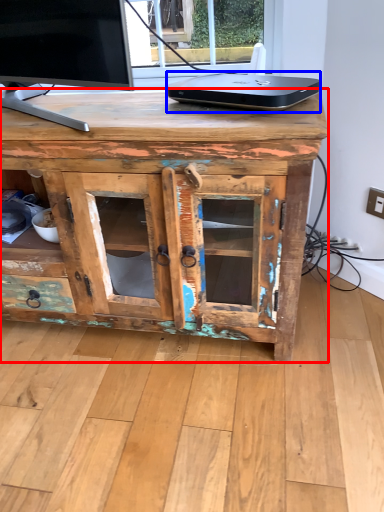
Question: Which point is further to the camera, desk (highlighted by a red box) or laptop (highlighted by a blue box)?

Choices:
 (A) desk
 (B) laptop

Answer: (B)